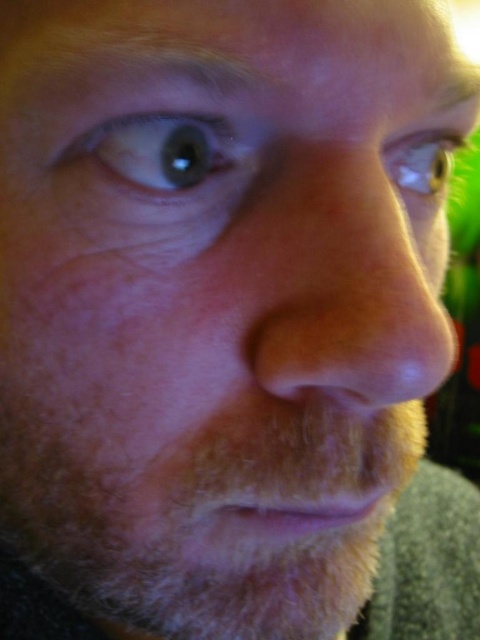
Question: Is blue glossy eye at upper left wider than green glossy eye at upper right?

Choices:
 (A) yes
 (B) no

Answer: (A)

Question: Which object appears farthest from the camera in this image?

Choices:
 (A) blue glossy eye at upper left
 (B) green glossy eye at upper right

Answer: (B)

Question: Can you confirm if blue glossy eye at upper left is bigger than green glossy eye at upper right?

Choices:
 (A) no
 (B) yes

Answer: (A)

Question: Can you confirm if blue glossy eye at upper left is positioned below green glossy eye at upper right?

Choices:
 (A) yes
 (B) no

Answer: (A)